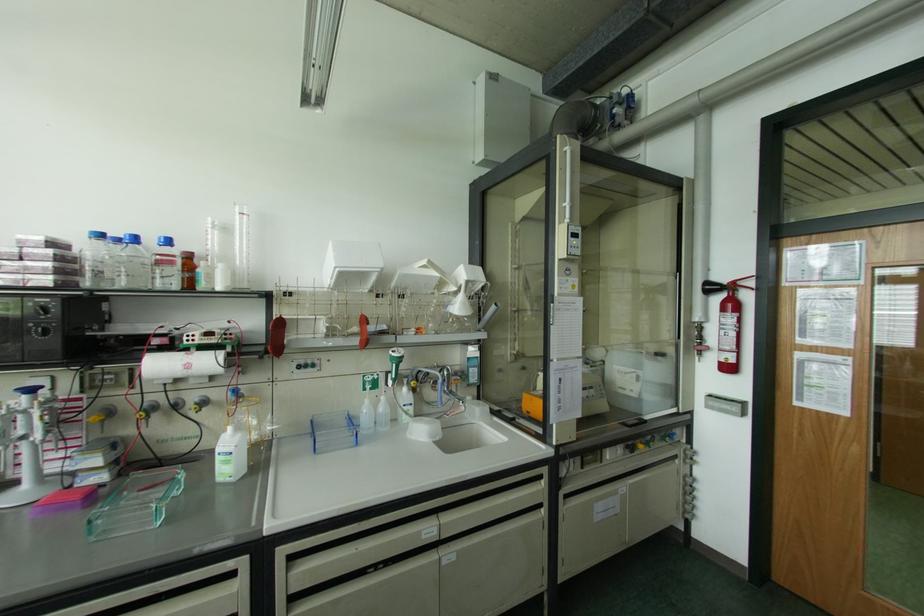
Where would you lift the brown glass bottle? Please return your answer as a coordinate pair (x, y).

(188, 270)